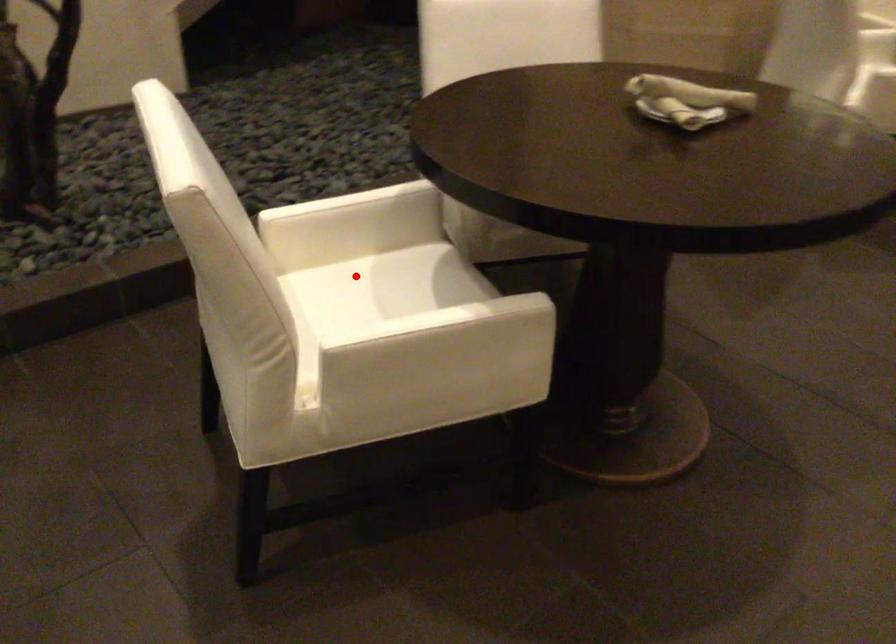
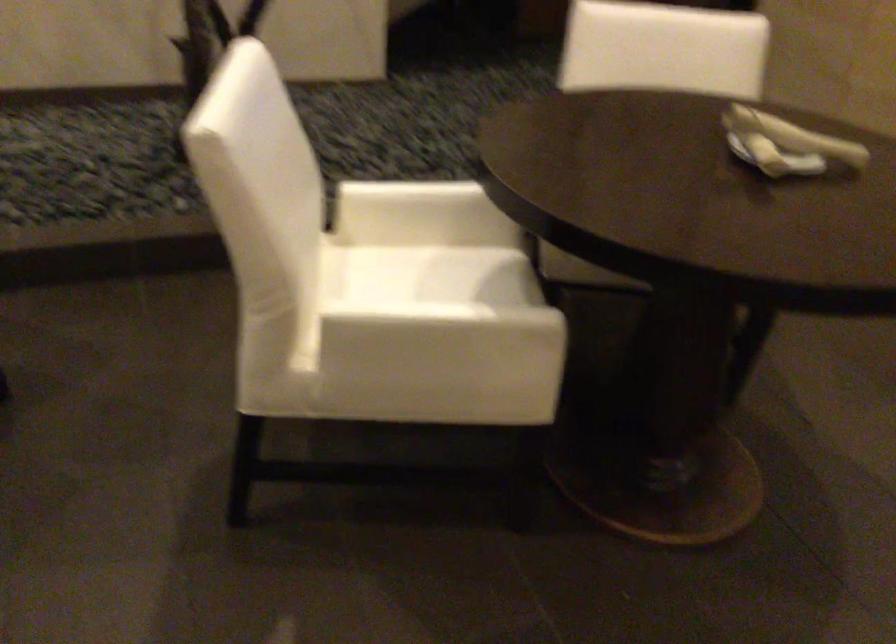
Locate, in the second image, the point that corresponds to the highlighted location in the first image.

(412, 261)